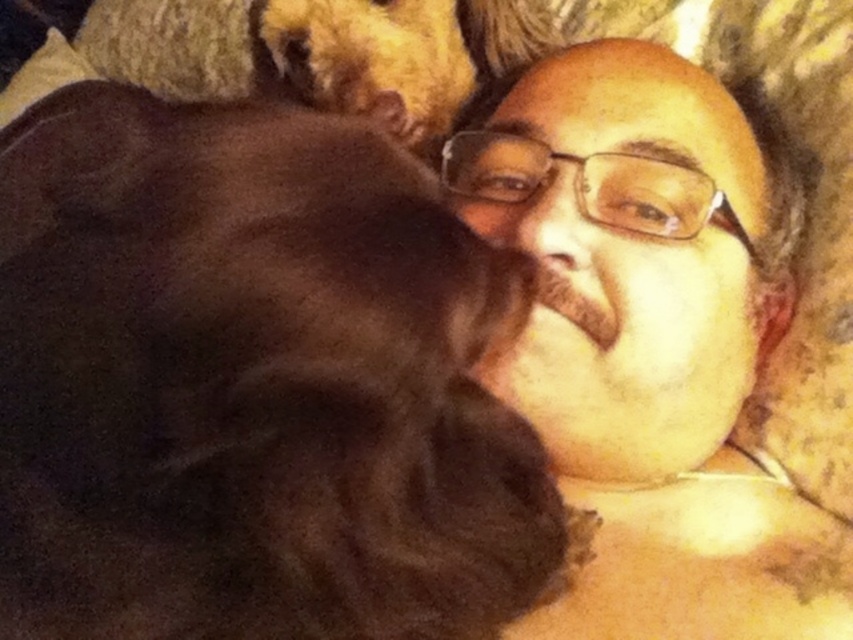
Can you confirm if brown fur dog at center is wider than smooth skin face at center?

No.

From the picture: Between brown fur dog at center and smooth skin face at center, which one has more height?

Standing taller between the two is smooth skin face at center.

This screenshot has width=853, height=640. Describe the element at coordinates (251, 384) in the screenshot. I see `brown fur dog at center` at that location.

I want to click on brown fur dog at center, so click(251, 384).

Which is above, smooth skin face at center or golden fur dog at upper center?

golden fur dog at upper center

This screenshot has height=640, width=853. Find the location of `smooth skin face at center`. smooth skin face at center is located at coordinates (654, 342).

Does brown fur dog at center have a lesser width compared to golden fur dog at upper center?

No.

Locate an element on the screen. The image size is (853, 640). brown fur dog at center is located at coordinates (251, 384).